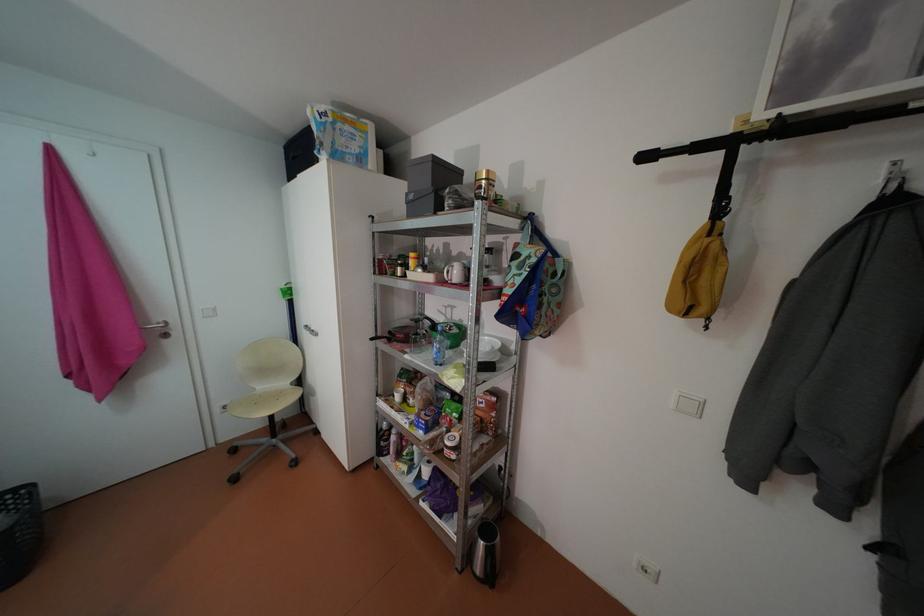
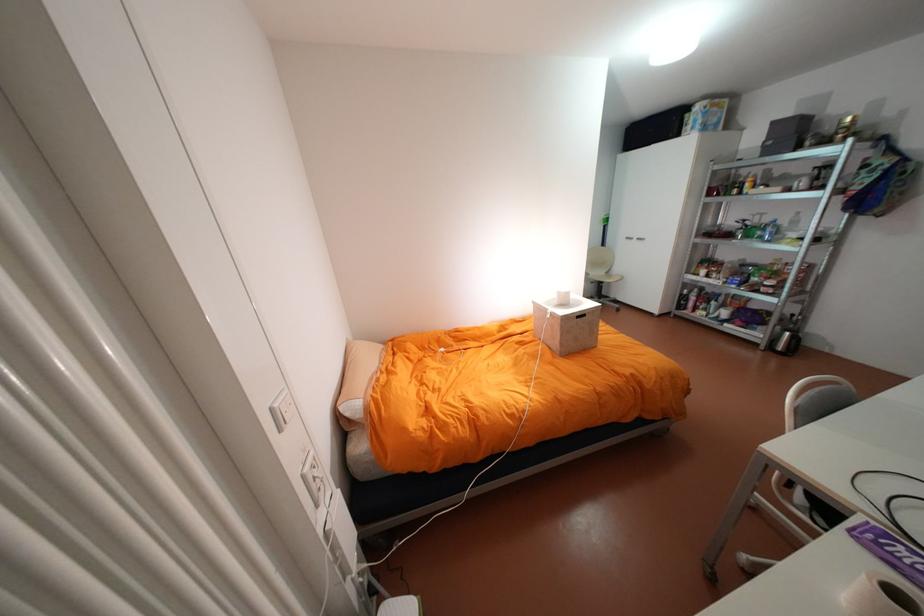
The point at (315, 326) is marked in the first image. Where is the corresponding point in the second image?

(636, 237)